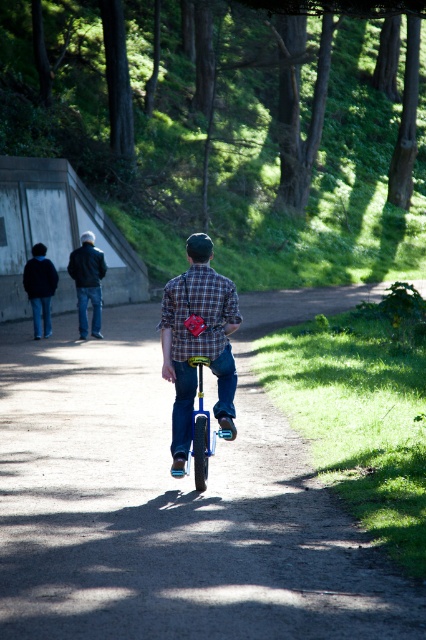
Question: Which object is positioned closest to the plaid shirt at center?

Choices:
 (A) blue metallic monocycle at center
 (B) blue metallic unicycle at center
 (C) dark blue jeans at center
 (D) plaid fabric shirt at center

Answer: (D)

Question: Does plaid shirt at center have a lesser width compared to blue metallic monocycle at center?

Choices:
 (A) yes
 (B) no

Answer: (B)

Question: Is blue metallic unicycle at center to the right of plaid shirt at center from the viewer's perspective?

Choices:
 (A) yes
 (B) no

Answer: (B)

Question: Which object is the closest to the blue metallic monocycle at center?

Choices:
 (A) dark blue jeans at center
 (B) blue metallic unicycle at center
 (C) plaid shirt at center
 (D) plaid fabric shirt at center

Answer: (C)

Question: Can you confirm if blue metallic unicycle at center is wider than blue metallic monocycle at center?

Choices:
 (A) no
 (B) yes

Answer: (B)

Question: Which point is farther to the camera?

Choices:
 (A) dark blue jeans at center
 (B) plaid fabric shirt at center
 (C) blue metallic unicycle at center
 (D) plaid shirt at center

Answer: (A)